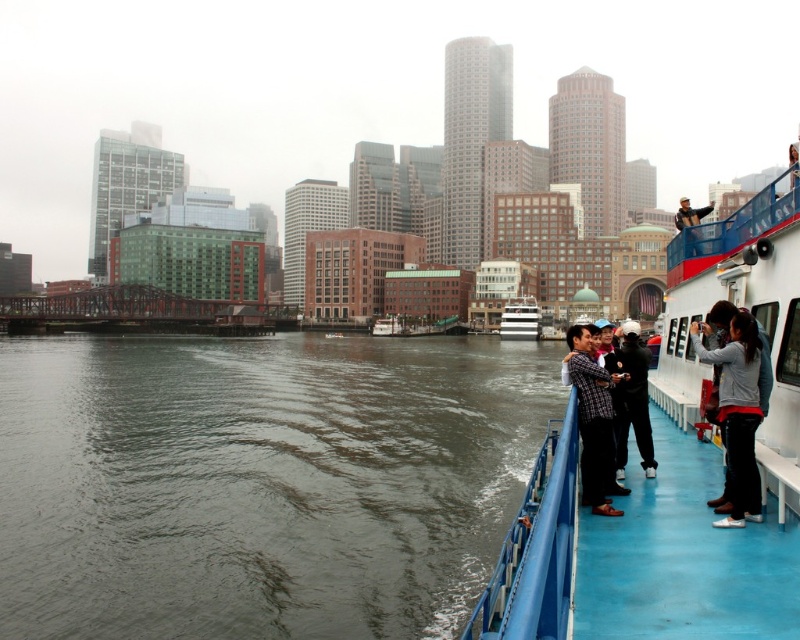
You are a passenger on the ferry and want to step onto the deck. Which object should you step onto first, the blue rubber deck at right or the blue plastic rail at right?

The blue rubber deck at right is positioned over the blue plastic rail at right, so you should step onto the blue rubber deck at right first.

You are a passenger on the ferry and want to take a photo of the city skyline. You notice the gray fleece jacket at upper right and the white glossy boat at center. Which object is closer to the camera so that it doesn not block the view?

The gray fleece jacket at upper right is shorter than the white glossy boat at center, so the jacket is closer to the camera and may block the view of the skyline behind it.

You are a maintenance worker on the ferry and need to place a 2.5 meter long equipment box on either the blue rubber deck at right or the blue plastic rail at right. Which surface can accommodate the box without exceeding its width?

The blue rubber deck at right has a greater width than the blue plastic rail at right, so the equipment box can be placed on the blue rubber deck at right if its width is at least 2.5 meters. However, the blue plastic rail at right is narrower, so it might not fit. Check the exact width of the deck before placing the box.